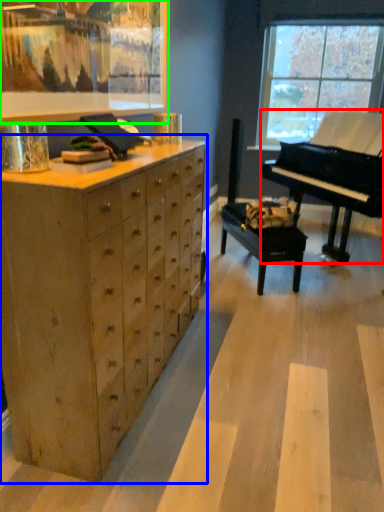
Question: Estimate the real-world distances between objects in this image. Which object is farther from piano (highlighted by a red box), chest of drawers (highlighted by a blue box) or picture frame (highlighted by a green box)?

Choices:
 (A) chest of drawers
 (B) picture frame

Answer: (A)